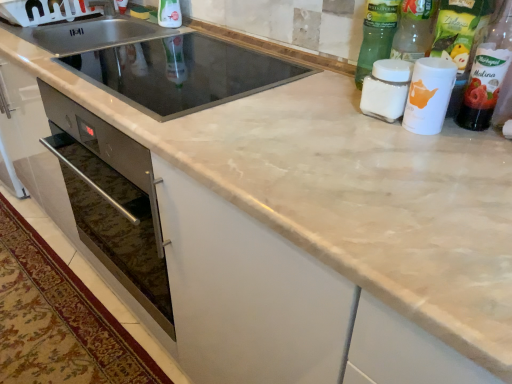
Question: Considering the positions of transparent plastic bottle at upper center, the first bottle when ordered from left to right, and white plastic cup at upper right, which is the 5th bottle in left-to-right order, in the image, is transparent plastic bottle at upper center, the first bottle when ordered from left to right, taller or shorter than white plastic cup at upper right, which is the 5th bottle in left-to-right order,?

Choices:
 (A) short
 (B) tall

Answer: (A)

Question: From the image's perspective, is transparent plastic bottle at upper center, which appears as the 6th bottle when viewed from the right, positioned above or below white plastic cup at upper right, the second bottle positioned from the right?

Choices:
 (A) below
 (B) above

Answer: (B)

Question: Estimate the real-world distances between objects in this image. Which object is farther from the green glass bottle at upper right, the 3th bottle positioned from the left?

Choices:
 (A) black glass sink at center, the first sink in the front-to-back sequence
 (B) white plastic cup at upper right, the second bottle positioned from the right
 (C) translucent plastic bottle at upper right, which is the 1th bottle from right to left
 (D) transparent plastic bottle at upper center, the first bottle when ordered from left to right
 (E) stainless steel sink at upper left, the first sink positioned from the back

Answer: (E)

Question: Which of these objects is positioned closest to the black glass sink at center, positioned as the 2th sink in back-to-front order?

Choices:
 (A) white matte jar at upper right, arranged as the second bottle when viewed from the left
 (B) translucent plastic bottle at upper right, placed as the sixth bottle when sorted from left to right
 (C) white matte cup at upper right, which ranks as the 3th bottle in right-to-left order
 (D) transparent plastic bottle at upper center, the first bottle when ordered from left to right
 (E) white plastic cup at upper right, which is the 5th bottle in left-to-right order

Answer: (D)